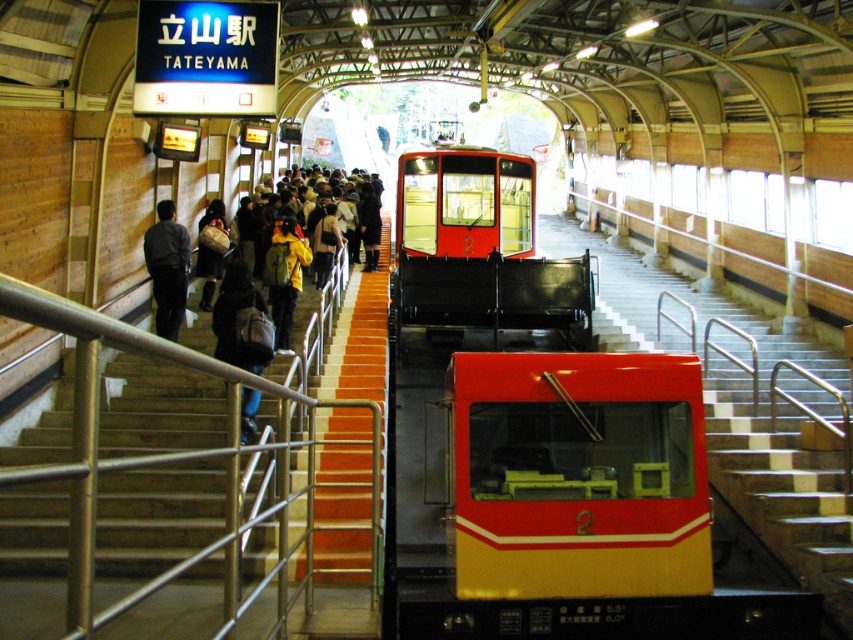
Question: Which object appears farthest from the camera in this image?

Choices:
 (A) matte black backpack at center
 (B) yellow matte jacket at center
 (C) wooden stairs at center

Answer: (A)

Question: Which object is positioned closest to the wooden stairs at center?

Choices:
 (A) wooden staircase at center
 (B) dark gray fabric jacket at left
 (C) yellow matte jacket at center

Answer: (B)

Question: Can you confirm if matte black train at center is thinner than dark blue denim jeans at center?

Choices:
 (A) no
 (B) yes

Answer: (B)

Question: Among these objects, which one is nearest to the camera?

Choices:
 (A) matte black train at center
 (B) wooden staircase at center

Answer: (B)

Question: Does dark blue denim jeans at center have a greater width compared to yellow matte jacket at center?

Choices:
 (A) no
 (B) yes

Answer: (B)

Question: In this image, where is wooden staircase at center located relative to wooden stairs at center?

Choices:
 (A) below
 (B) above

Answer: (B)